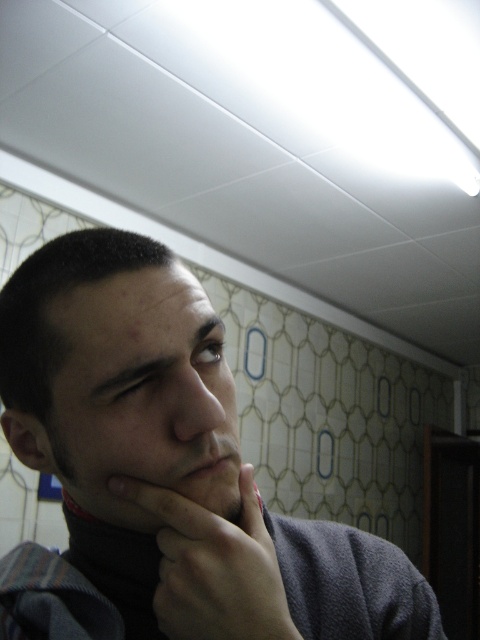
Which is more to the left, gray matte turtleneck at center or matte skin at center?

gray matte turtleneck at center is more to the left.

Is gray matte turtleneck at center positioned at the back of matte skin at center?

No, it is in front of matte skin at center.

I want to click on gray matte turtleneck at center, so click(x=159, y=476).

Where is `gray matte turtleneck at center`? This screenshot has height=640, width=480. gray matte turtleneck at center is located at coordinates (159, 476).

Is smooth skin hand at center to the right of matte skin at center from the viewer's perspective?

Correct, you'll find smooth skin hand at center to the right of matte skin at center.

Is smooth skin hand at center taller than matte skin at center?

No, smooth skin hand at center is not taller than matte skin at center.

Where is `smooth skin hand at center`? smooth skin hand at center is located at coordinates (213, 564).

I want to click on smooth skin hand at center, so click(x=213, y=564).

Between gray matte turtleneck at center and smooth skin hand at center, which one is positioned higher?

smooth skin hand at center is higher up.

Which is behind, point (271, 596) or point (162, 589)?

The point (162, 589) is behind.

Where is `gray matte turtleneck at center`? Image resolution: width=480 pixels, height=640 pixels. gray matte turtleneck at center is located at coordinates (159, 476).